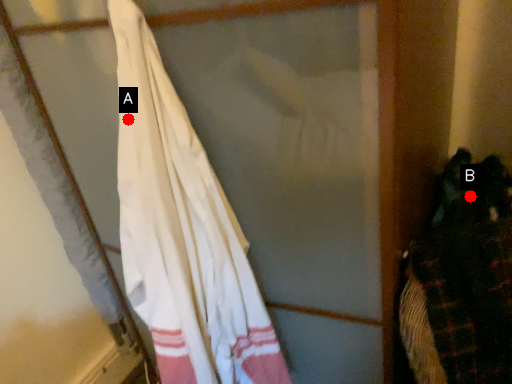
Question: Two points are circled on the image, labeled by A and B beside each circle. Which point is closer to the camera?

Choices:
 (A) A is closer
 (B) B is closer

Answer: (A)